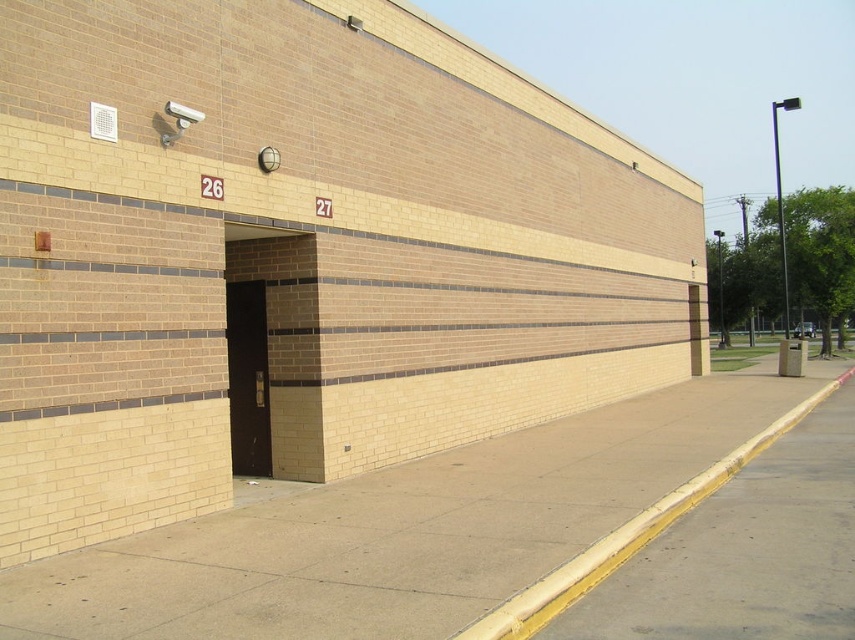
You are a delivery person trying to find the entrance to the building. You see the concrete at center and the black metal door at center. Which one is the entrance? Explain your reasoning based on their sizes.

The black metal door at center is the entrance because entrances are typically doors, and the concrete at center, though larger in size, is likely part of the building structure rather than an entrance.

You are standing in front of the building with the two doors. There is a point at coordinates point [826,464] that you need to reach. Can you estimate how far you need to walk to get there?

The point [826,464] is 9.29 meters away from the viewer, so you need to walk approximately 9.29 meters to reach it.

You are standing on the gray concrete sidewalk at lower right and want to reach the dark brown wood door at center. Since the sidewalk is lower, what might you need to do to access the door?

The gray concrete sidewalk at lower right has a lesser height compared to the dark brown wood door at center, so you would need to climb a small step or stairs to reach the door from the sidewalk.